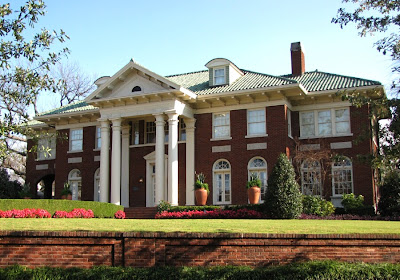
Where is `1 door`? The width and height of the screenshot is (400, 280). 1 door is located at coordinates (153, 195).